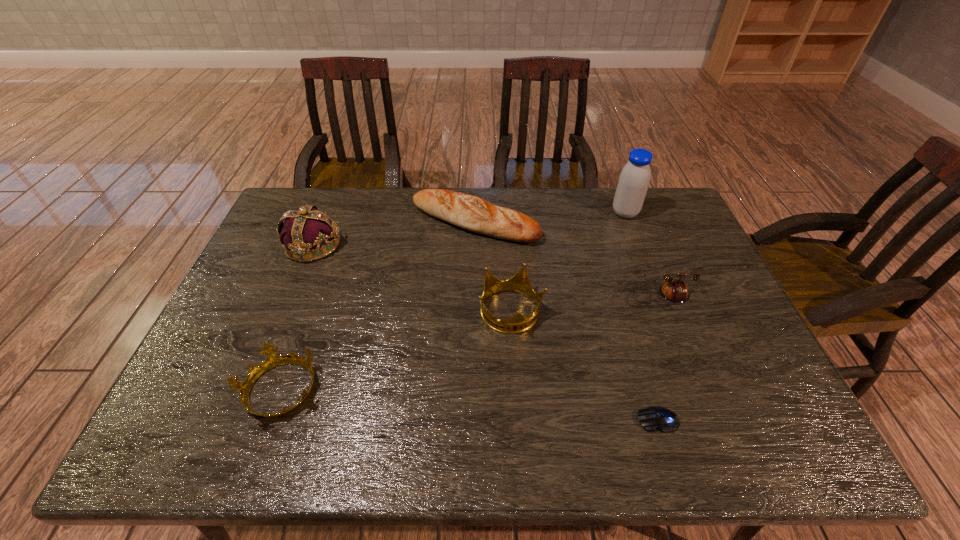
The width and height of the screenshot is (960, 540). Identify the location of the tallest object. (634, 179).

The width and height of the screenshot is (960, 540). Find the location of `the sixth shortest object`. the sixth shortest object is located at coordinates (305, 229).

At what (x,y) coordinates should I click in order to perform the action: click on the farthest crown. Please return your answer as a coordinate pair (x, y). The height and width of the screenshot is (540, 960). Looking at the image, I should click on (305, 229).

Where is `the second tallest crown`? The image size is (960, 540). the second tallest crown is located at coordinates (520, 283).

Image resolution: width=960 pixels, height=540 pixels. I want to click on the rightmost crown, so coord(520,283).

Identify the location of baguet. (469, 212).

Where is `telephone`? This screenshot has height=540, width=960. telephone is located at coordinates (673, 290).

The image size is (960, 540). I want to click on the shortest crown, so click(x=273, y=360).

You are a GUI agent. You are given a task and a screenshot of the screen. Output one action in this format:
    pyautogui.click(x=<x>, y=<y>)
    Task: Click on the shortest object
    This screenshot has height=540, width=960.
    Given the screenshot: What is the action you would take?
    pyautogui.click(x=654, y=417)

The width and height of the screenshot is (960, 540). I want to click on vacant space situated 0.100m on the right of the tallest object, so click(668, 213).